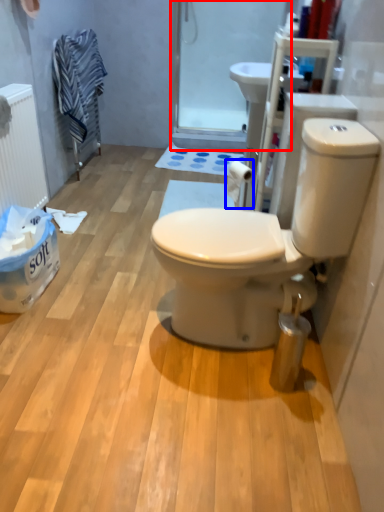
Question: Which point is further to the camera, screen door (highlighted by a red box) or toilet paper (highlighted by a blue box)?

Choices:
 (A) screen door
 (B) toilet paper

Answer: (A)